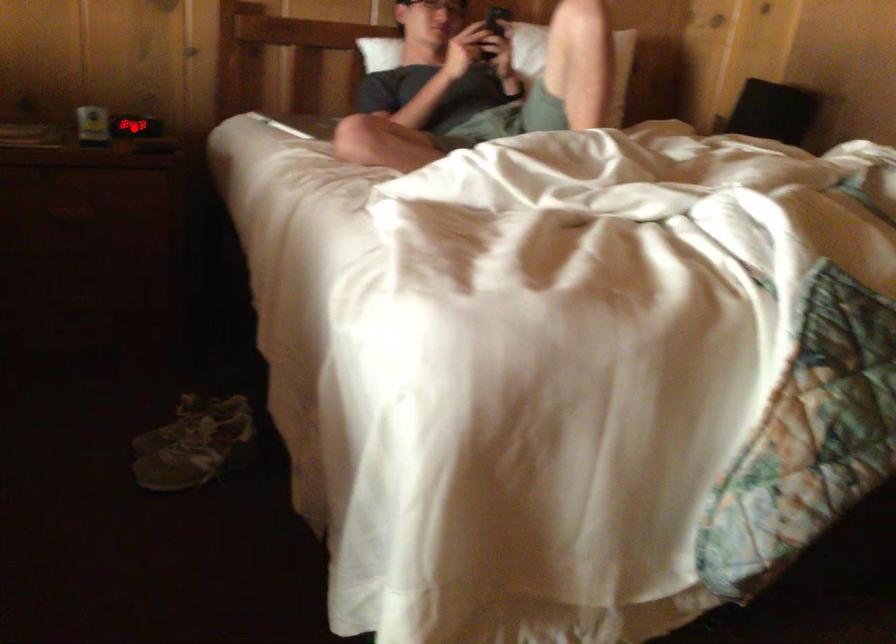
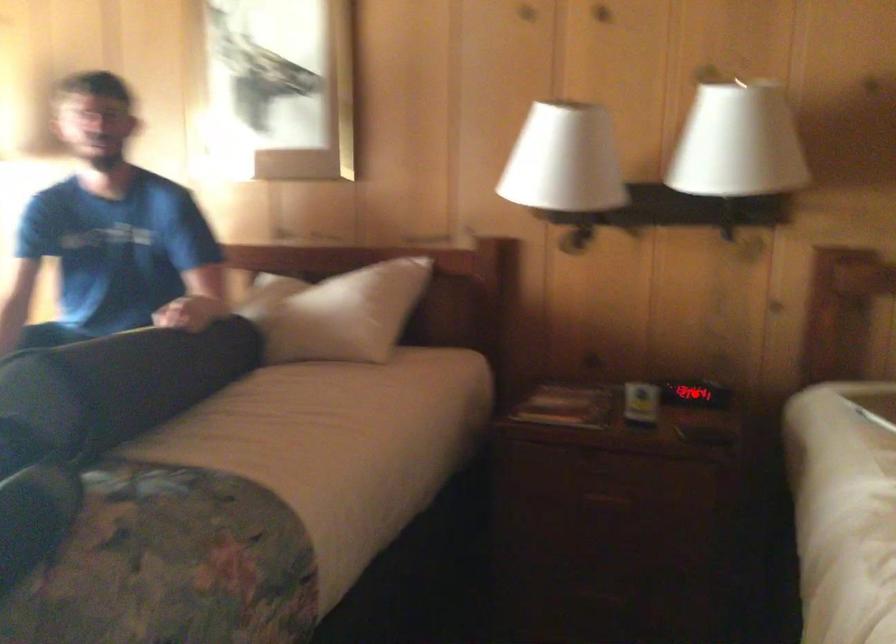
I am providing you with two images of the same scene from different viewpoints. A red point is marked on the first image and another point is marked on the second image. Is the marked point in image1 the same physical position as the marked point in image2?

Yes